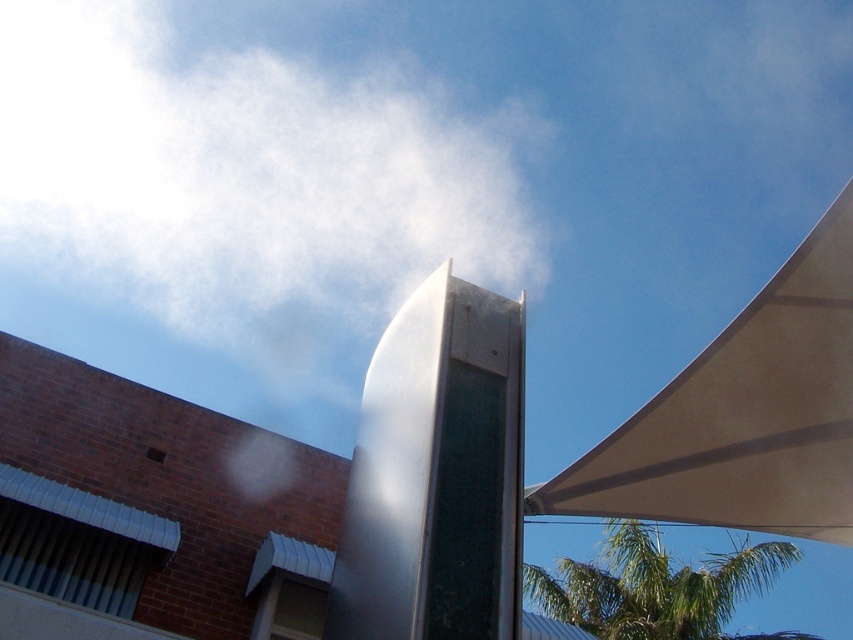
Looking at this image, who is more forward, (579, 508) or (711, 605)?

Point (579, 508) is more forward.

Is the position of beige fabric canopy at upper right less distant than that of green leafy palm tree at upper right?

Yes, it is in front of green leafy palm tree at upper right.

Locate an element on the screen. The height and width of the screenshot is (640, 853). beige fabric canopy at upper right is located at coordinates (743, 416).